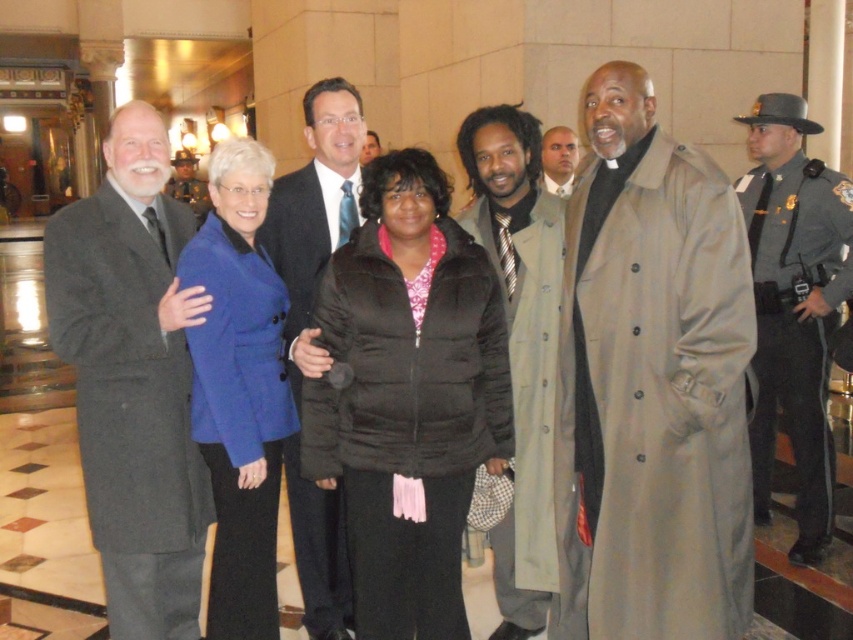
Question: Which object appears closest to the camera in this image?

Choices:
 (A) blue woolen blazer at center
 (B) matte black suit at left
 (C) light brown leather jacket at center
 (D) light brown textured coat at center

Answer: (B)

Question: Does light brown trench coat at center appear under blue woolen blazer at center?

Choices:
 (A) yes
 (B) no

Answer: (B)

Question: Is black puffer jacket at center further to camera compared to matte black suit at left?

Choices:
 (A) no
 (B) yes

Answer: (A)

Question: Does blue woolen blazer at center appear over shiny blue suit at center?

Choices:
 (A) no
 (B) yes

Answer: (A)

Question: Among these objects, which one is nearest to the camera?

Choices:
 (A) light brown textured coat at center
 (B) gray uniformed officer at right
 (C) shiny blue suit at center
 (D) blue woolen blazer at center

Answer: (C)

Question: Which point is closer to the camera taking this photo?

Choices:
 (A) (598, 189)
 (B) (160, 282)

Answer: (A)